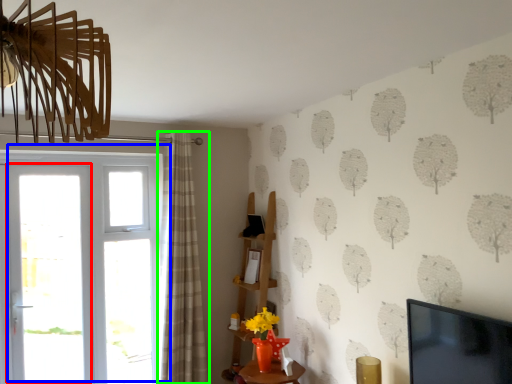
Question: Which object is the closest to the screen door (highlighted by a red box)? Choose among these: door (highlighted by a blue box) or curtain (highlighted by a green box).

Choices:
 (A) door
 (B) curtain

Answer: (A)